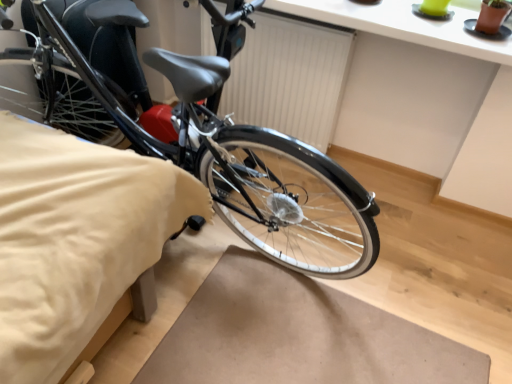
Question: From a real-world perspective, is white matte radiator at center on shiny black bicycle at left?

Choices:
 (A) no
 (B) yes

Answer: (A)

Question: Is white matte radiator at center bigger than shiny black bicycle at left?

Choices:
 (A) yes
 (B) no

Answer: (B)

Question: From the image's perspective, is white matte radiator at center located beneath shiny black bicycle at left?

Choices:
 (A) no
 (B) yes

Answer: (A)

Question: Considering the relative sizes of white matte radiator at center and shiny black bicycle at left in the image provided, is white matte radiator at center thinner than shiny black bicycle at left?

Choices:
 (A) no
 (B) yes

Answer: (B)

Question: Is white matte radiator at center turned away from shiny black bicycle at left?

Choices:
 (A) no
 (B) yes

Answer: (A)

Question: In terms of size, does beige fabric bedsheet at lower left appear bigger or smaller than white matte radiator at center?

Choices:
 (A) big
 (B) small

Answer: (A)

Question: Is beige fabric bedsheet at lower left to the left or to the right of white matte radiator at center in the image?

Choices:
 (A) left
 (B) right

Answer: (A)

Question: Which is correct: beige fabric bedsheet at lower left is inside white matte radiator at center, or outside of it?

Choices:
 (A) outside
 (B) inside

Answer: (A)

Question: Is beige fabric bedsheet at lower left wider or thinner than white matte radiator at center?

Choices:
 (A) thin
 (B) wide

Answer: (B)

Question: Considering their positions, is shiny black bicycle at left located in front of or behind beige fabric bedsheet at lower left?

Choices:
 (A) behind
 (B) front

Answer: (A)

Question: Based on their positions, is shiny black bicycle at left located to the left or right of beige fabric bedsheet at lower left?

Choices:
 (A) left
 (B) right

Answer: (B)

Question: Based on their sizes in the image, would you say shiny black bicycle at left is bigger or smaller than beige fabric bedsheet at lower left?

Choices:
 (A) small
 (B) big

Answer: (A)

Question: From a real-world perspective, is shiny black bicycle at left physically located above or below beige fabric bedsheet at lower left?

Choices:
 (A) below
 (B) above

Answer: (B)

Question: Considering the relative positions of white matte radiator at center and shiny black bicycle at left in the image provided, is white matte radiator at center to the left or to the right of shiny black bicycle at left?

Choices:
 (A) right
 (B) left

Answer: (A)

Question: Is point (301, 87) closer or farther from the camera than point (372, 198)?

Choices:
 (A) closer
 (B) farther

Answer: (B)